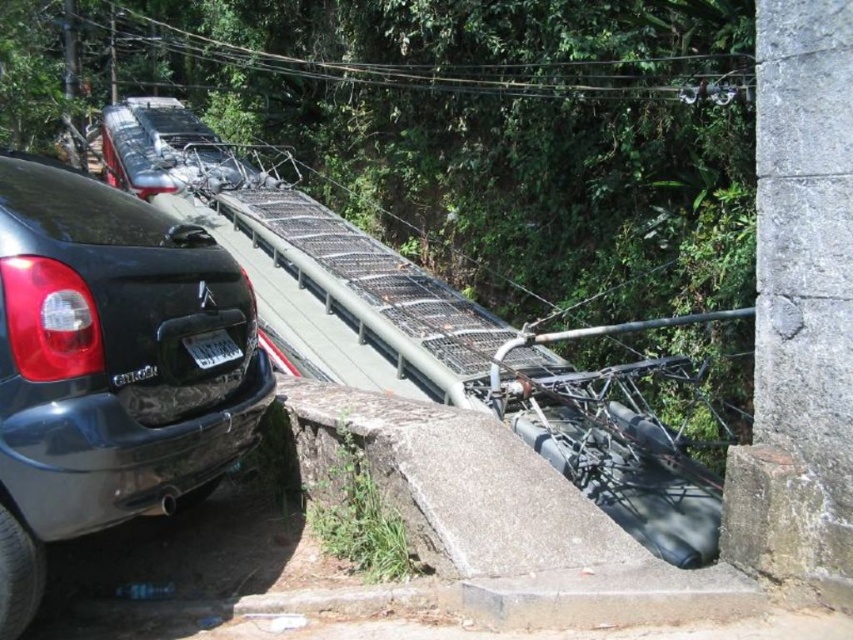
Question: Which object is closer to the camera taking this photo?

Choices:
 (A) black wire at upper center
 (B) matte black car at left

Answer: (B)

Question: Does matte black car at left appear on the right side of white plastic license plate at center?

Choices:
 (A) yes
 (B) no

Answer: (B)

Question: Can you confirm if black wire at upper center is positioned to the left of white plastic license plate at center?

Choices:
 (A) yes
 (B) no

Answer: (A)

Question: Which point is closer to the camera?

Choices:
 (A) black wire at upper center
 (B) white plastic license plate at center

Answer: (B)

Question: In this image, where is black wire at upper center located relative to white plastic license plate at center?

Choices:
 (A) above
 (B) below

Answer: (A)

Question: Among these points, which one is nearest to the camera?

Choices:
 (A) tap(700, 56)
 (B) tap(148, 260)

Answer: (B)